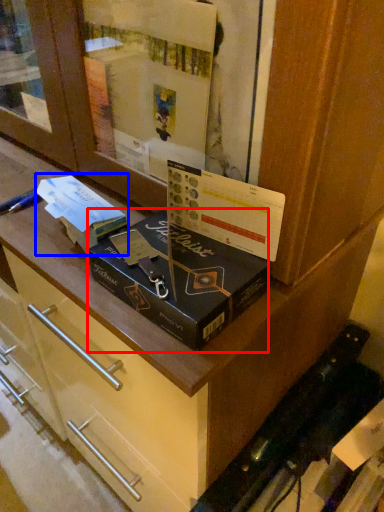
Question: Which object appears farthest to the camera in this image, box (highlighted by a red box) or book (highlighted by a blue box)?

Choices:
 (A) box
 (B) book

Answer: (B)